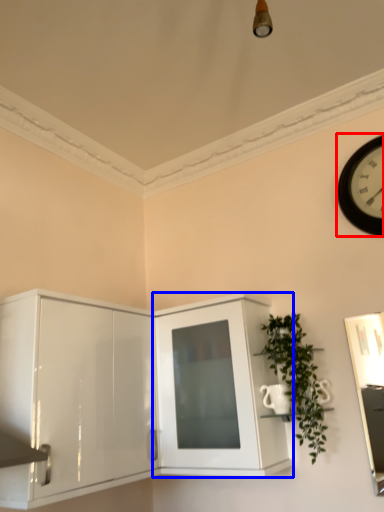
Question: Among these objects, which one is nearest to the camera, wall clock (highlighted by a red box) or cabinetry (highlighted by a blue box)?

Choices:
 (A) wall clock
 (B) cabinetry

Answer: (B)